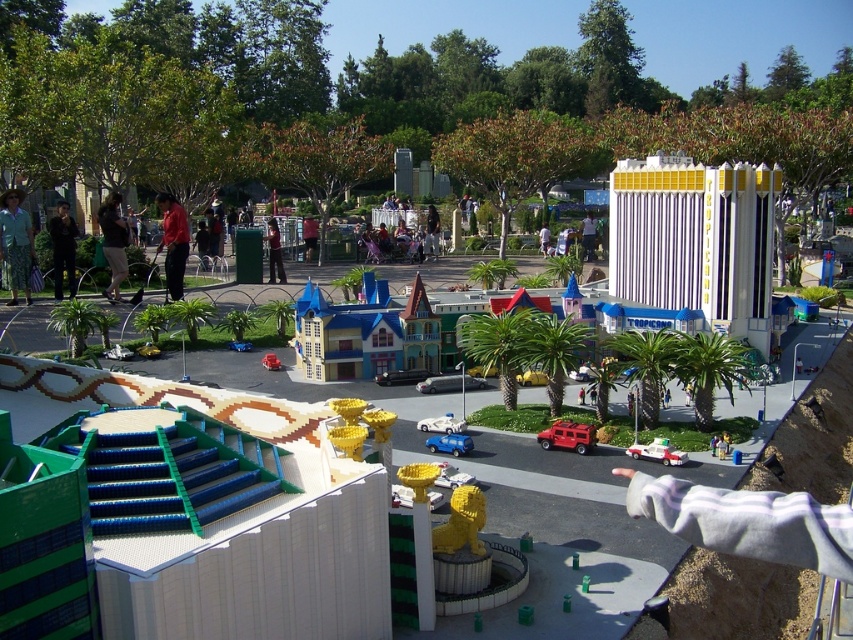
You are a visitor in the miniature city and see the camouflage pants at left and the red plastic fire truck at center. Which object is positioned higher from the ground?

The camouflage pants at left is above the red plastic fire truck at center, so it is positioned higher from the ground.

You are a visitor at the miniature city and notice a red shirt at left and a red plastic fire truck at center. Which object is higher up in the scene?

The red shirt at left is located above the red plastic fire truck at center, so the red shirt at left is higher up in the scene.

You are standing in the miniature cityscape and want to place a small flag at the point closer to you between point (115, 259) and point (57, 241). Which point should you choose?

Point (115, 259) is closer to the camera than point (57, 241), so you should choose point (115, 259) to place the flag.